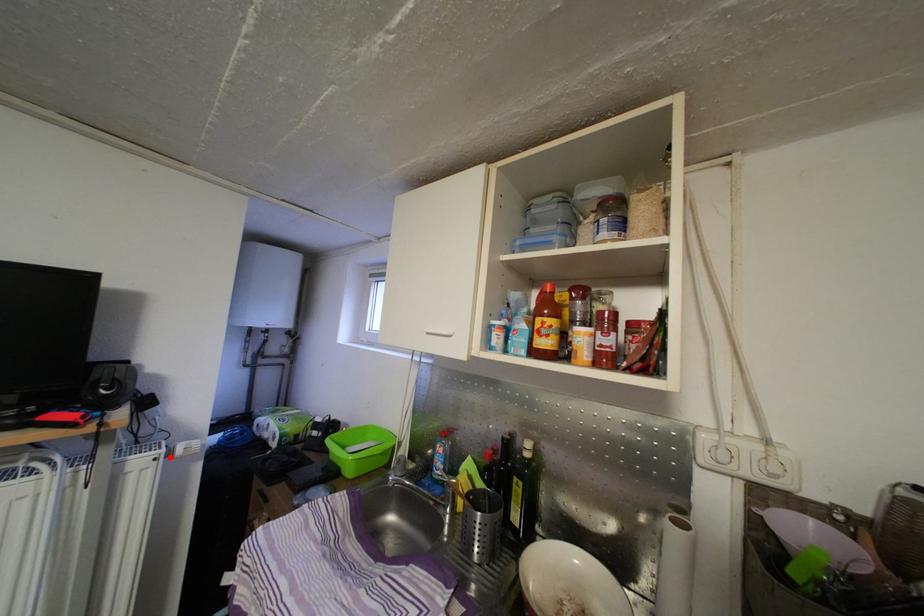
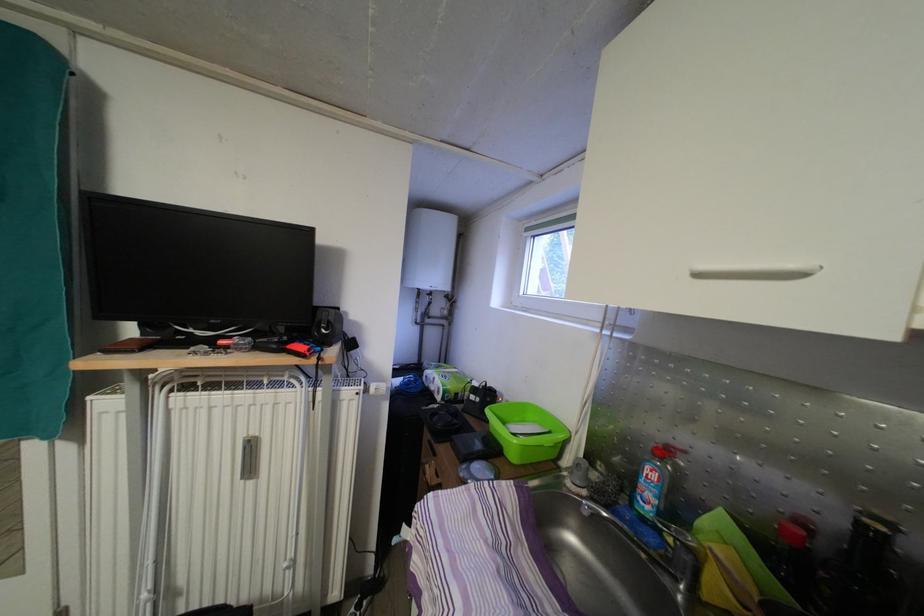
In the second image, find the point that corresponds to the highlighted location in the first image.

(369, 394)